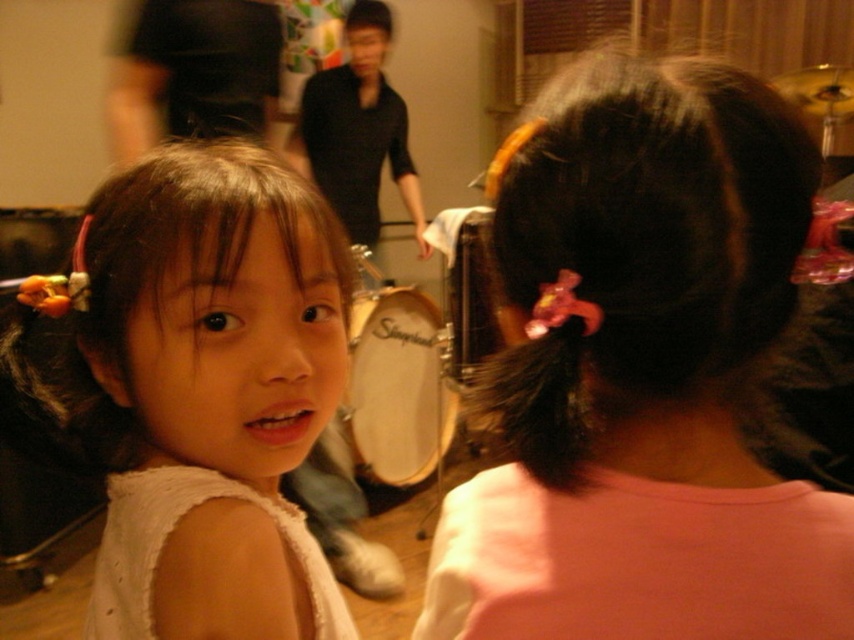
Is pink cotton dress at back above white lace dress at lower left?

Yes, pink cotton dress at back is above white lace dress at lower left.

The image size is (854, 640). Identify the location of pink cotton dress at back. (638, 561).

Between point (595, 541) and point (109, 595), which one is positioned in front?

Positioned in front is point (595, 541).

Find the location of a particular element. pink cotton dress at back is located at coordinates (638, 561).

Can you confirm if matte white dress at left is positioned to the right of dark brown silky hair at upper right?

Incorrect, matte white dress at left is not on the right side of dark brown silky hair at upper right.

Who is shorter, matte white dress at left or dark brown silky hair at upper right?

With less height is dark brown silky hair at upper right.

Does point (145, 406) lie in front of point (776, 163)?

No, it is behind (776, 163).

The height and width of the screenshot is (640, 854). I want to click on matte white dress at left, so click(202, 388).

Between dark brown silky hair at upper right and white lace dress at lower left, which one has less height?

Standing shorter between the two is white lace dress at lower left.

Can you confirm if dark brown silky hair at upper right is wider than white lace dress at lower left?

No.

Who is more distant from viewer, (527, 262) or (137, 609)?

Point (137, 609)

Find the location of a particular element. dark brown silky hair at upper right is located at coordinates (646, 266).